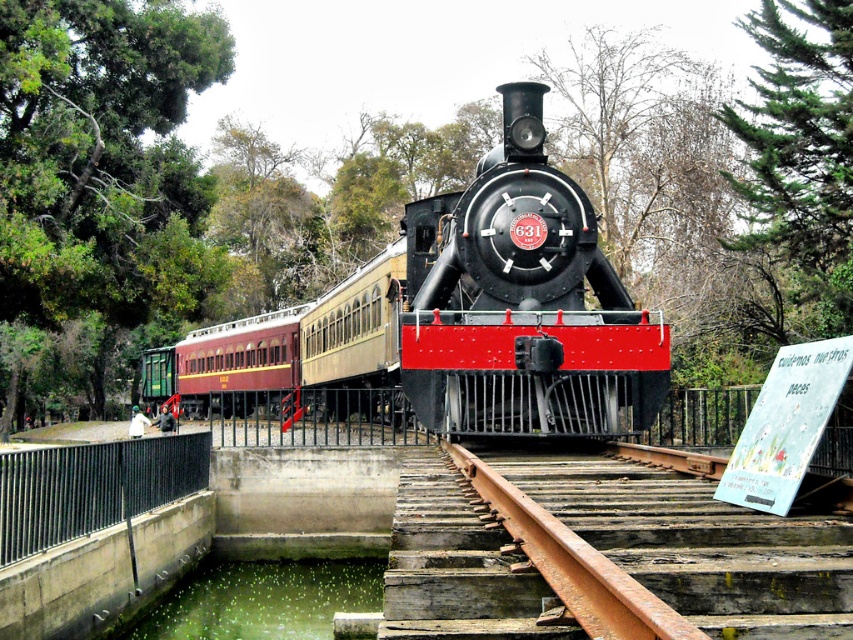
Which of these two, black polished metal steam engine at center or black metal fence at lower left, stands taller?

black metal fence at lower left is taller.

Find the location of `black polished metal steam engine at center`. black polished metal steam engine at center is located at coordinates (521, 301).

The width and height of the screenshot is (853, 640). What are the coordinates of `black polished metal steam engine at center` in the screenshot? It's located at (521, 301).

Does point (126, 468) come behind point (142, 618)?

No, (126, 468) is closer to viewer.

Is black metal fence at lower left wider than green liquid at lower left?

No.

This screenshot has height=640, width=853. What do you see at coordinates (91, 486) in the screenshot? I see `black metal fence at lower left` at bounding box center [91, 486].

Where is `black metal fence at lower left`? The width and height of the screenshot is (853, 640). black metal fence at lower left is located at coordinates (91, 486).

Is black polished metal steam engine at center bigger than green liquid at lower left?

No.

Measure the distance between black polished metal steam engine at center and camera.

They are 36.80 feet apart.

Where is `black polished metal steam engine at center`? black polished metal steam engine at center is located at coordinates (521, 301).